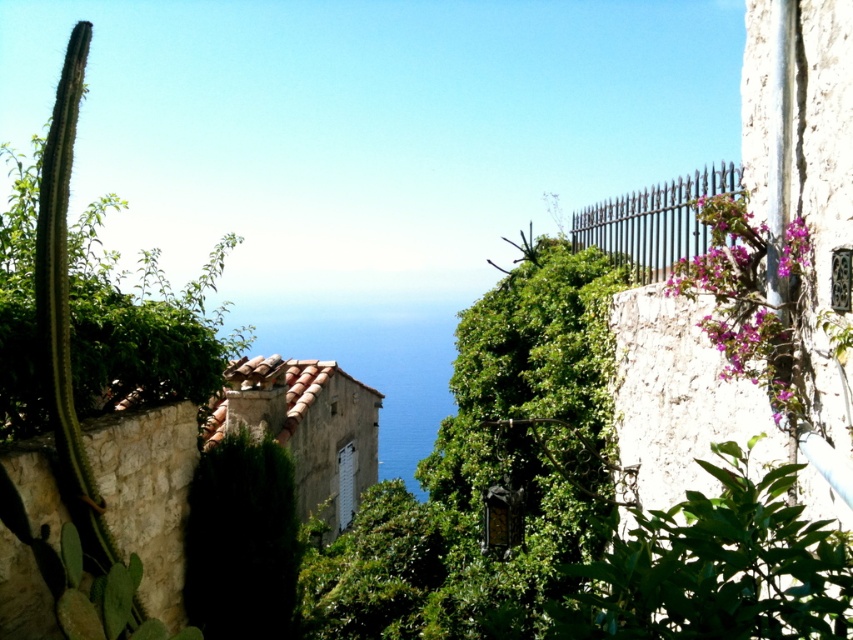
Question: Considering the relative positions of pink matte flowers at upper right and black wrought iron fence at upper right in the image provided, where is pink matte flowers at upper right located with respect to black wrought iron fence at upper right?

Choices:
 (A) above
 (B) below

Answer: (B)

Question: Which object is positioned closest to the black wrought iron fence at upper right?

Choices:
 (A) pink matte flowers at upper right
 (B) purple matte flowers at upper right

Answer: (A)

Question: Based on their relative distances, which object is farther from the pink matte flowers at upper right?

Choices:
 (A) black wrought iron fence at upper right
 (B) purple matte flowers at upper right

Answer: (A)

Question: Is pink matte flowers at upper right positioned behind purple matte flowers at upper right?

Choices:
 (A) no
 (B) yes

Answer: (B)

Question: Which of the following is the closest to the observer?

Choices:
 (A) (809, 252)
 (B) (630, 259)
 (C) (790, 422)

Answer: (A)

Question: Can you confirm if pink matte flowers at upper right is positioned below purple matte flowers at upper right?

Choices:
 (A) yes
 (B) no

Answer: (A)